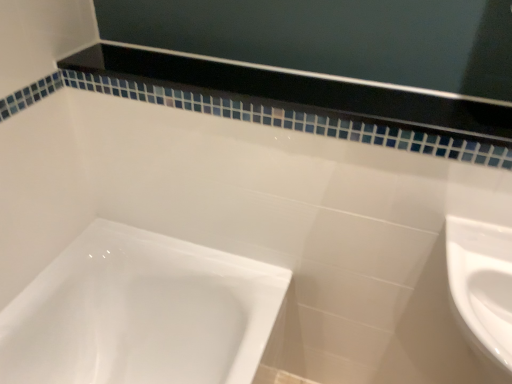
Question: Which is correct: white glossy sink at lower right is inside black glossy balustrade at upper center, or outside of it?

Choices:
 (A) outside
 (B) inside

Answer: (A)

Question: From the image's perspective, is white glossy sink at lower right above or below black glossy balustrade at upper center?

Choices:
 (A) below
 (B) above

Answer: (A)

Question: Considering the relative positions of white glossy sink at lower right and black glossy balustrade at upper center in the image provided, is white glossy sink at lower right to the left or to the right of black glossy balustrade at upper center?

Choices:
 (A) right
 (B) left

Answer: (A)

Question: Considering the positions of black glossy balustrade at upper center and white glossy sink at lower right in the image, is black glossy balustrade at upper center wider or thinner than white glossy sink at lower right?

Choices:
 (A) wide
 (B) thin

Answer: (B)

Question: From the image's perspective, is black glossy balustrade at upper center positioned above or below white glossy sink at lower right?

Choices:
 (A) above
 (B) below

Answer: (A)

Question: From their relative heights in the image, would you say black glossy balustrade at upper center is taller or shorter than white glossy sink at lower right?

Choices:
 (A) short
 (B) tall

Answer: (A)

Question: Is black glossy balustrade at upper center in front of or behind white glossy sink at lower right in the image?

Choices:
 (A) front
 (B) behind

Answer: (B)